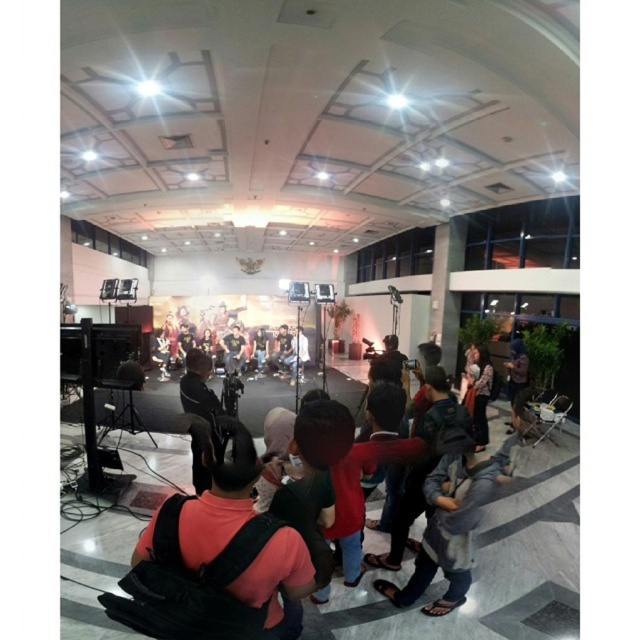
Question: Does matte black backpack at center appear on the right side of matte black camera at center?

Choices:
 (A) yes
 (B) no

Answer: (A)

Question: Is matte black backpack at center above matte black camera at center?

Choices:
 (A) yes
 (B) no

Answer: (B)

Question: Which object is closer to the camera taking this photo?

Choices:
 (A) matte yellow fabric at center
 (B) matte black backpack at center
 (C) matte black camera at center

Answer: (B)

Question: Estimate the real-world distances between objects in this image. Which object is farther from the matte yellow fabric at center?

Choices:
 (A) matte black backpack at center
 (B) matte black camera at center

Answer: (A)

Question: Does matte black backpack at center have a greater width compared to matte yellow fabric at center?

Choices:
 (A) yes
 (B) no

Answer: (B)

Question: Which object is the farthest from the matte black camera at center?

Choices:
 (A) matte black backpack at center
 (B) matte yellow fabric at center

Answer: (A)